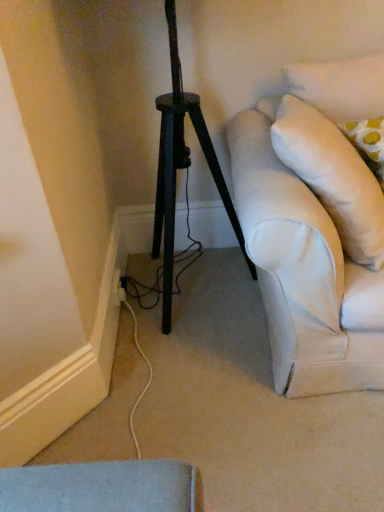
Question: Is white soft pillow at right next to white plastic electric outlet at lower left?

Choices:
 (A) no
 (B) yes

Answer: (A)

Question: Would you consider white soft pillow at right to be distant from white plastic electric outlet at lower left?

Choices:
 (A) yes
 (B) no

Answer: (B)

Question: From a real-world perspective, is white soft pillow at right located higher than white plastic electric outlet at lower left?

Choices:
 (A) yes
 (B) no

Answer: (A)

Question: From a real-world perspective, is white soft pillow at right positioned under white plastic electric outlet at lower left based on gravity?

Choices:
 (A) no
 (B) yes

Answer: (A)

Question: Is white soft pillow at right turned away from white plastic electric outlet at lower left?

Choices:
 (A) yes
 (B) no

Answer: (B)

Question: Is the position of white soft pillow at right less distant than that of white plastic electric outlet at lower left?

Choices:
 (A) yes
 (B) no

Answer: (A)

Question: Can you confirm if white plastic electric outlet at lower left is bigger than white soft pillow at right?

Choices:
 (A) no
 (B) yes

Answer: (A)

Question: From a real-world perspective, does white plastic electric outlet at lower left sit lower than white soft pillow at right?

Choices:
 (A) no
 (B) yes

Answer: (B)

Question: From the image's perspective, is white plastic electric outlet at lower left beneath white soft pillow at right?

Choices:
 (A) no
 (B) yes

Answer: (B)

Question: From a real-world perspective, is white plastic electric outlet at lower left on top of white soft pillow at right?

Choices:
 (A) no
 (B) yes

Answer: (A)

Question: Is the surface of white plastic electric outlet at lower left in direct contact with white soft pillow at right?

Choices:
 (A) yes
 (B) no

Answer: (B)

Question: Does white plastic electric outlet at lower left appear on the left side of white soft pillow at right?

Choices:
 (A) yes
 (B) no

Answer: (A)

Question: Is white plastic electric outlet at lower left in front of or behind white soft pillow at right in the image?

Choices:
 (A) behind
 (B) front

Answer: (A)